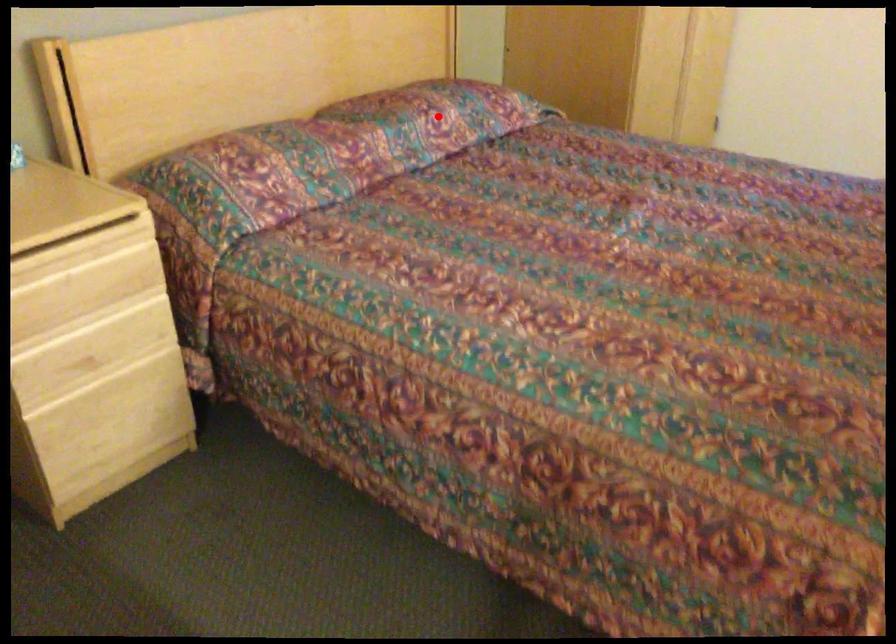
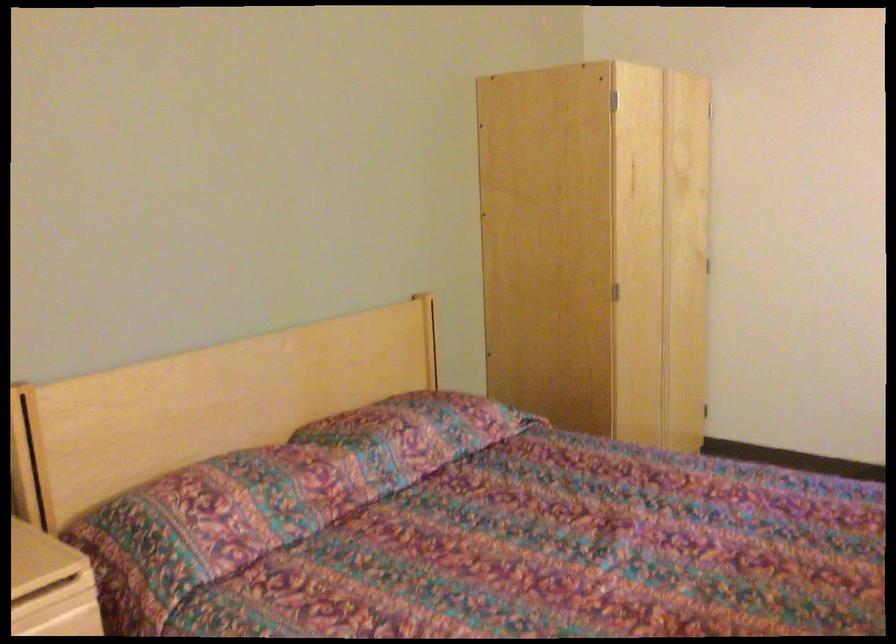
Where in the second image is the point corresponding to the highlighted location from the first image?

(414, 433)